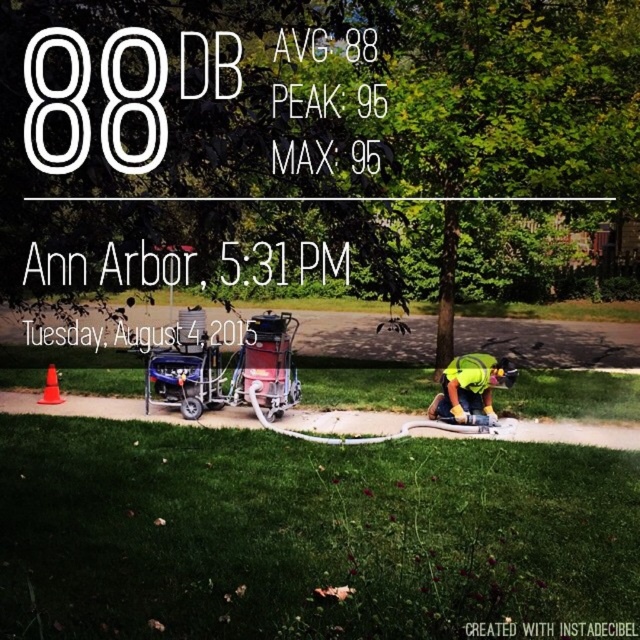
Is metallic blue cart at center bigger than yellow reflective safety vest at lower right?

Incorrect, metallic blue cart at center is not larger than yellow reflective safety vest at lower right.

Between point (264, 340) and point (508, 380), which one is positioned behind?

The point (264, 340) is more distant.

Find the location of a particular element. metallic blue cart at center is located at coordinates (225, 368).

Is metallic blue cart at center shorter than orange plastic cone at lower left?

Incorrect, metallic blue cart at center's height does not fall short of orange plastic cone at lower left's.

The height and width of the screenshot is (640, 640). Identify the location of metallic blue cart at center. (225, 368).

This screenshot has height=640, width=640. I want to click on metallic blue cart at center, so point(225,368).

Is metallic blue cart at center below yellow fabric safety vest at lower right?

Incorrect, metallic blue cart at center is not positioned below yellow fabric safety vest at lower right.

Based on the photo, is metallic blue cart at center to the right of yellow fabric safety vest at lower right from the viewer's perspective?

Incorrect, metallic blue cart at center is not on the right side of yellow fabric safety vest at lower right.

What do you see at coordinates (225, 368) in the screenshot? The height and width of the screenshot is (640, 640). I see `metallic blue cart at center` at bounding box center [225, 368].

I want to click on metallic blue cart at center, so click(x=225, y=368).